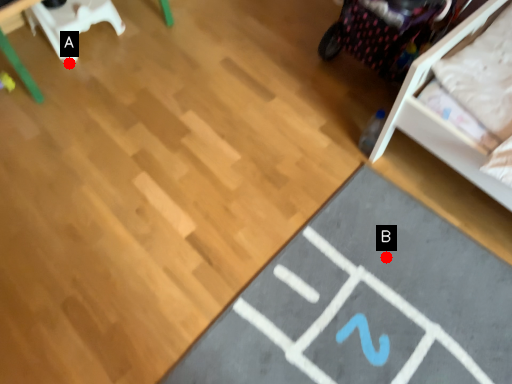
Question: Two points are circled on the image, labeled by A and B beside each circle. Which point appears farthest from the camera in this image?

Choices:
 (A) A is further
 (B) B is further

Answer: (A)